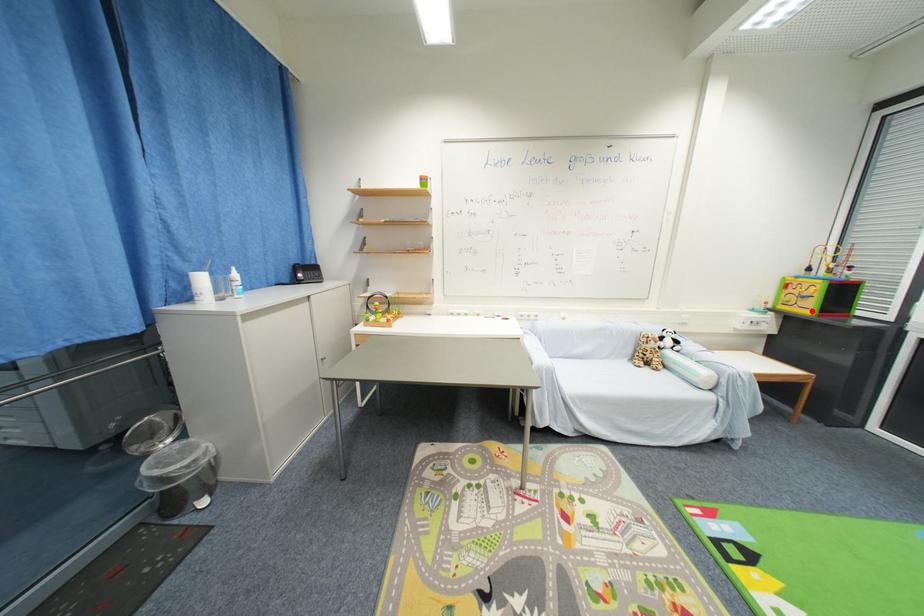
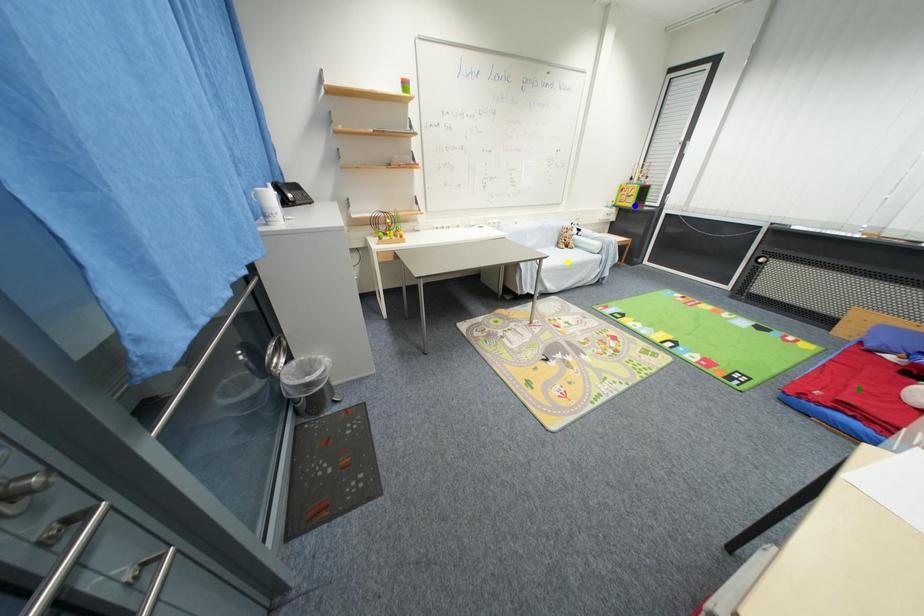
Question: I am providing you with two images of the same scene from different viewpoints. A red point is marked on the first image. You are given multiple points on the second image. Which mark in image 2 goes with the point in image 1?

Choices:
 (A) yellow point
 (B) blue point
 (C) green point

Answer: (B)